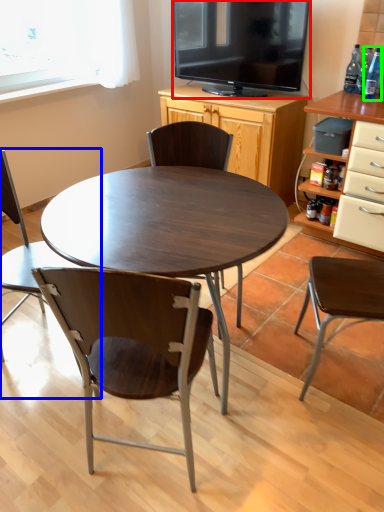
Question: Estimate the real-world distances between objects in this image. Which object is closer to television (highlighted by a red box), chair (highlighted by a blue box) or bottle (highlighted by a green box)?

Choices:
 (A) chair
 (B) bottle

Answer: (B)